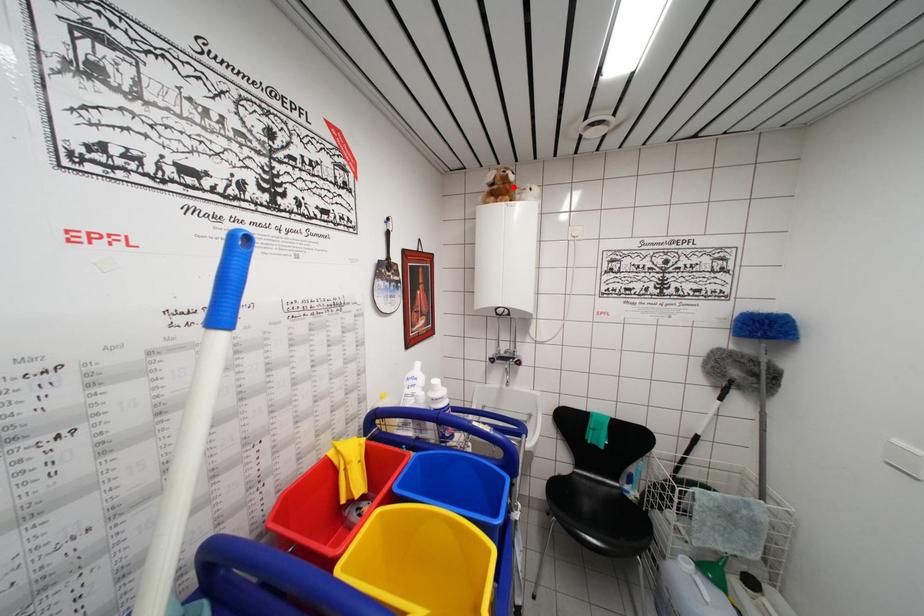
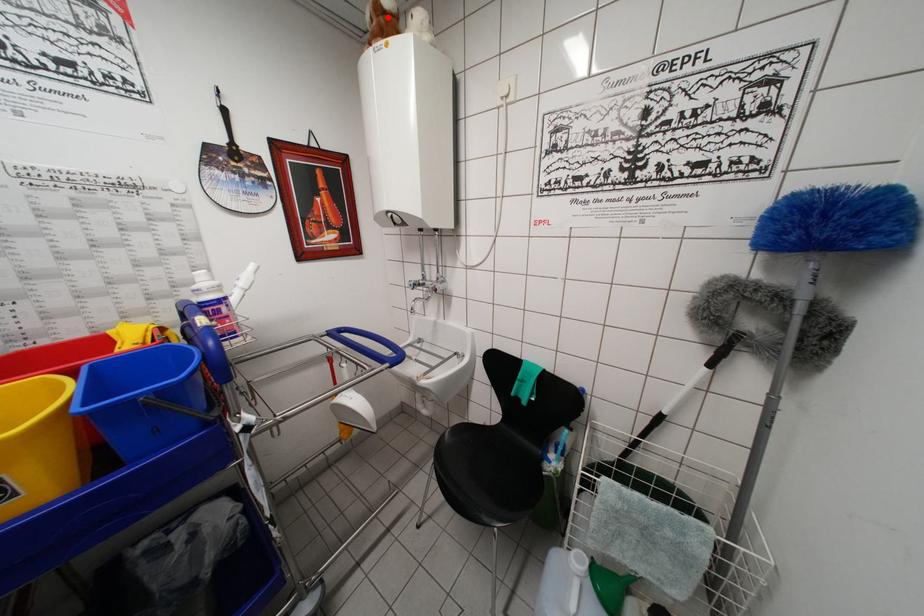
I am providing you with two images of the same scene from different viewpoints. A red point is marked on the first image and another point is marked on the second image. Are the points marked in image1 and image2 representing the same 3D position?

Yes